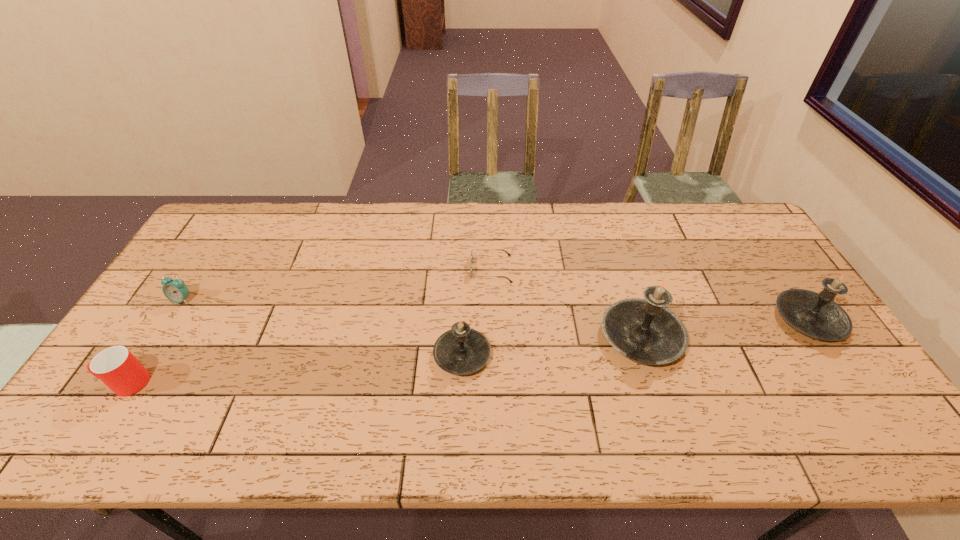
Where is `the closest object to the rightmost candle`? The width and height of the screenshot is (960, 540). the closest object to the rightmost candle is located at coordinates (644, 330).

Point out which object is positioned as the second nearest to the second object from right to left. Please provide its 2D coordinates. Your answer should be formatted as a tuple, i.e. [(x, y)], where the tuple contains the x and y coordinates of a point satisfying the conditions above.

[(815, 314)]

I want to click on candle that can be found as the second closest to the sunglasses, so click(x=644, y=330).

You are a GUI agent. You are given a task and a screenshot of the screen. Output one action in this format:
    pyautogui.click(x=<x>, y=<y>)
    Task: Click on the candle that is the second closest to the sunglasses
    
    Given the screenshot: What is the action you would take?
    pyautogui.click(x=644, y=330)

Image resolution: width=960 pixels, height=540 pixels. I want to click on vacant space that satisfies the following two spatial constraints: 1. on the face of the alarm clock; 2. on the right side of the shortest candle, so click(147, 355).

You are a GUI agent. You are given a task and a screenshot of the screen. Output one action in this format:
    pyautogui.click(x=<x>, y=<y>)
    Task: Click on the vacant space that satisfies the following two spatial constraints: 1. on the side of the shortest candle with the handle; 2. on the left side of the cup
    Image resolution: width=960 pixels, height=540 pixels.
    Given the screenshot: What is the action you would take?
    pyautogui.click(x=144, y=355)

In order to click on free space that satisfies the following two spatial constraints: 1. on the back side of the leftmost candle; 2. on the left side of the tallest candle in this screenshot , I will do `click(463, 336)`.

Identify the location of free point that satisfies the following two spatial constraints: 1. on the side of the cup with the handle; 2. on the right side of the second shortest candle. The width and height of the screenshot is (960, 540). (167, 319).

Locate an element on the screen. This screenshot has height=540, width=960. vacant space that satisfies the following two spatial constraints: 1. on the side of the second tallest candle with the handle; 2. on the right side of the cup is located at coordinates (167, 319).

Identify the location of vacant area that satisfies the following two spatial constraints: 1. on the front-facing side of the sunglasses; 2. on the face of the alarm clock. This screenshot has height=540, width=960. (492, 300).